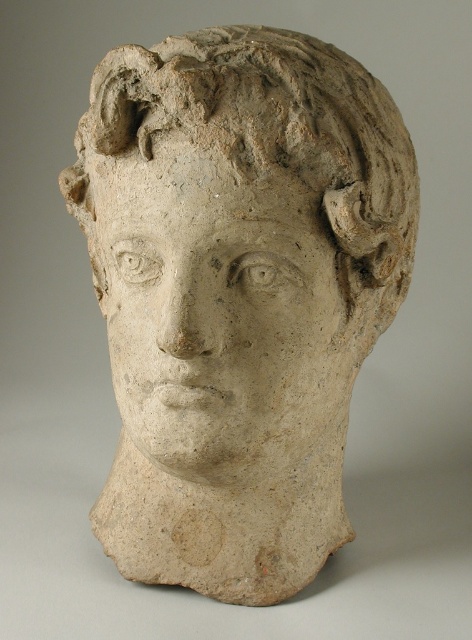
Between matte clay head at center and matte stone face at center, which one has less height?

matte stone face at center is shorter.

Is matte clay head at center bigger than matte stone face at center?

Correct, matte clay head at center is larger in size than matte stone face at center.

The width and height of the screenshot is (472, 640). What do you see at coordinates (237, 227) in the screenshot?
I see `matte clay head at center` at bounding box center [237, 227].

Identify the location of matte clay head at center. (237, 227).